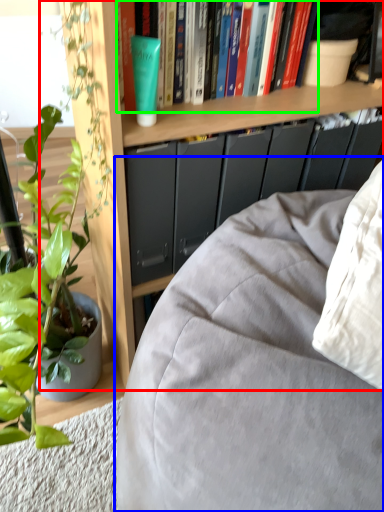
Question: Which object is positioned closest to bookcase (highlighted by a red box)? Select from studio couch (highlighted by a blue box) and book (highlighted by a green box).

Choices:
 (A) studio couch
 (B) book

Answer: (B)